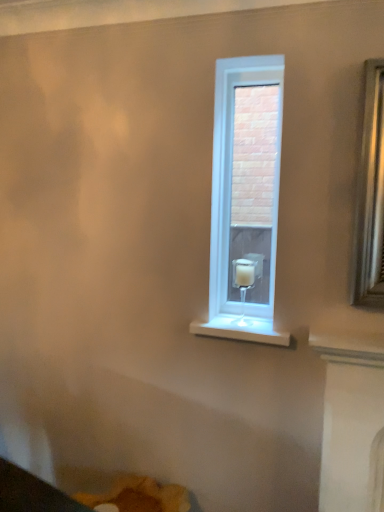
Question: Does point (271, 83) appear closer or farther from the camera than point (246, 280)?

Choices:
 (A) farther
 (B) closer

Answer: (B)

Question: From a real-world perspective, is white glass window at center above or below white glass candle holder at center?

Choices:
 (A) above
 (B) below

Answer: (A)

Question: Is white glass window at center in front of or behind white glass candle holder at center in the image?

Choices:
 (A) front
 (B) behind

Answer: (B)

Question: Visually, is white glass candle holder at center positioned to the left or to the right of white glass window at center?

Choices:
 (A) left
 (B) right

Answer: (A)

Question: From the image's perspective, is white glass candle holder at center located above or below white glass window at center?

Choices:
 (A) above
 (B) below

Answer: (B)

Question: From a real-world perspective, relative to white glass window at center, is white glass candle holder at center vertically above or below?

Choices:
 (A) below
 (B) above

Answer: (A)

Question: Considering the positions of white glass candle holder at center and white glass window at center in the image, is white glass candle holder at center taller or shorter than white glass window at center?

Choices:
 (A) short
 (B) tall

Answer: (A)